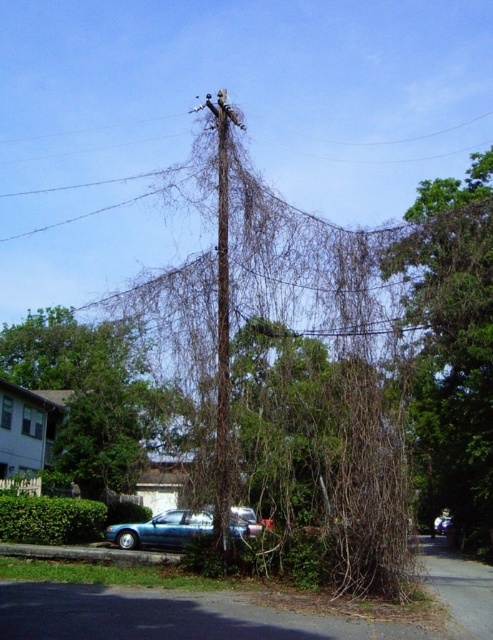
Can you confirm if brown textured vines at upper right is positioned to the right of green leafy tree at center?

Indeed, brown textured vines at upper right is positioned on the right side of green leafy tree at center.

Does brown textured vines at upper right lie in front of green leafy tree at center?

That is True.

Which is behind, point (391, 272) or point (7, 365)?

Point (7, 365)

Identify the location of brown textured vines at upper right. The image size is (493, 640). (452, 346).

Is green leafy tree at center further to the viewer compared to metallic wire at center?

That is True.

Which of these two, green leafy tree at center or metallic wire at center, stands shorter?

metallic wire at center is shorter.

Is point (126, 438) positioned in front of point (224, 188)?

That is False.

Identify the location of green leafy tree at center. (97, 397).

Can you confirm if brown textured vines at upper right is positioned above metallic wire at center?

No, brown textured vines at upper right is not above metallic wire at center.

Consider the image. Who is positioned more to the left, brown textured vines at upper right or metallic wire at center?

metallic wire at center

Find the location of `brown textured vines at upper right`. brown textured vines at upper right is located at coordinates (452, 346).